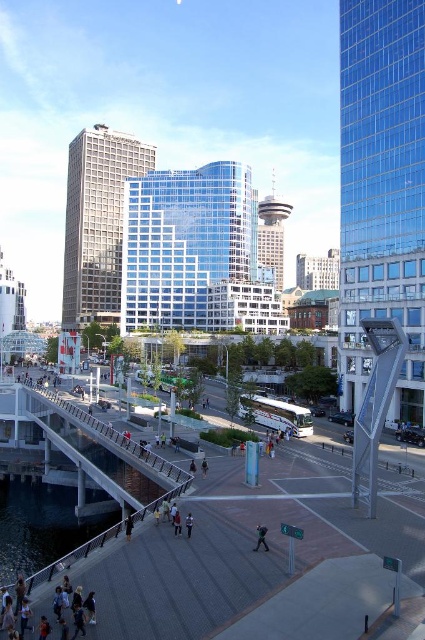
Question: Is transparent glass building at center below concrete gray pedestrian bridge at lower left?

Choices:
 (A) yes
 (B) no

Answer: (B)

Question: Which is farther from the clear water at lower left?

Choices:
 (A) dark blue jeans at center
 (B) light gray fabric jacket at center

Answer: (B)

Question: In this image, where is glassy steel tower at center located relative to light gray fabric jacket at center?

Choices:
 (A) left
 (B) right

Answer: (B)

Question: Which point is closer to the camera?

Choices:
 (A) (130, 330)
 (B) (187, 532)
 (C) (87, 584)

Answer: (C)

Question: Can you confirm if transparent glass building at center is wider than clear water at lower left?

Choices:
 (A) no
 (B) yes

Answer: (B)

Question: Which point appears farthest from the camera in this image?

Choices:
 (A) (104, 276)
 (B) (127, 528)
 (C) (257, 540)
 (D) (351, 209)

Answer: (A)